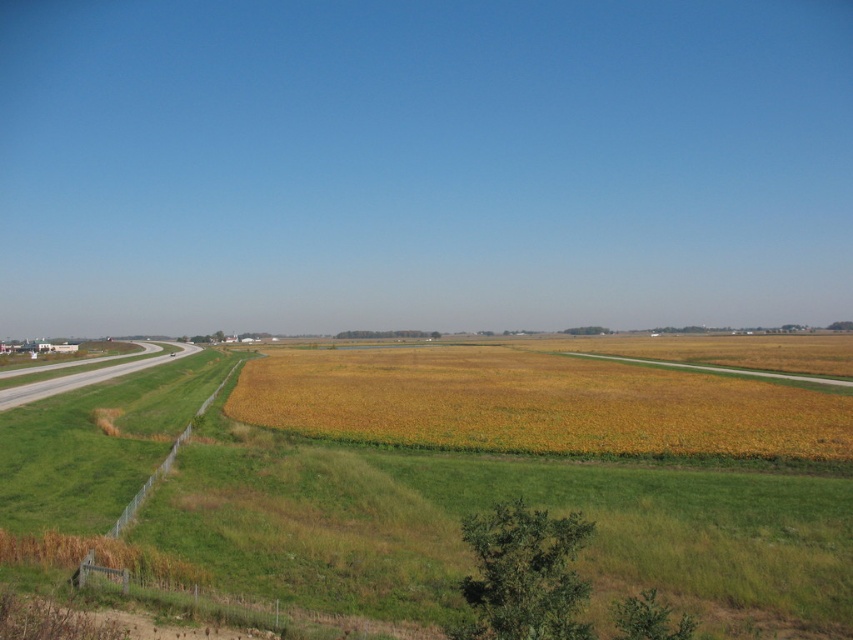
Question: Where is yellow-green grassland at center located in relation to yellow-green grain at center in the image?

Choices:
 (A) right
 (B) left

Answer: (B)

Question: Can you confirm if yellow-green grassland at center is positioned below yellow-green grain at center?

Choices:
 (A) yes
 (B) no

Answer: (B)

Question: Among these points, which one is nearest to the camera?

Choices:
 (A) 323,392
 (B) 380,545
 (C) 19,403

Answer: (B)

Question: Which of the following is the closest to the observer?

Choices:
 (A) gray asphalt runway at left
 (B) yellow-green grain at center
 (C) yellow-green grassland at center

Answer: (C)

Question: Does yellow-green grain at center have a smaller size compared to gray asphalt runway at left?

Choices:
 (A) yes
 (B) no

Answer: (B)

Question: Which point is farther to the camera?

Choices:
 (A) gray asphalt runway at left
 (B) yellow-green grain at center
 (C) yellow-green grassland at center

Answer: (A)